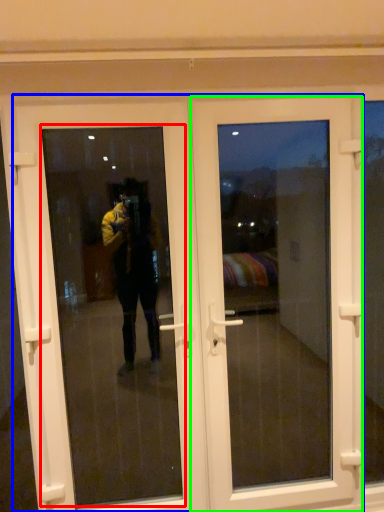
Question: Considering the real-world distances, which object is closest to window screen (highlighted by a red box)? door (highlighted by a blue box) or door (highlighted by a green box).

Choices:
 (A) door
 (B) door

Answer: (A)